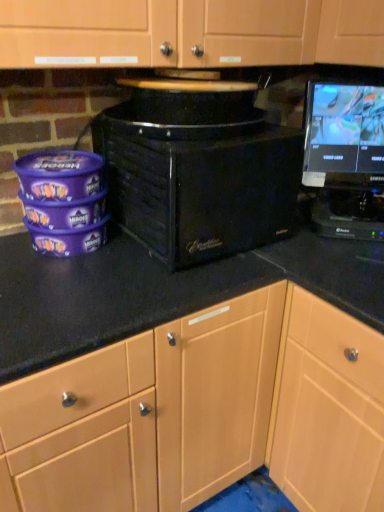
Question: Would you consider black matte microwave at center to be distant from light wood cabinet at lower right?

Choices:
 (A) no
 (B) yes

Answer: (A)

Question: From a real-world perspective, is black matte microwave at center beneath light wood cabinet at lower right?

Choices:
 (A) no
 (B) yes

Answer: (A)

Question: Is black matte microwave at center aimed at light wood cabinet at lower right?

Choices:
 (A) yes
 (B) no

Answer: (B)

Question: From the image's perspective, would you say black matte microwave at center is positioned over light wood cabinet at lower right?

Choices:
 (A) yes
 (B) no

Answer: (A)

Question: Does black matte microwave at center have a smaller size compared to light wood cabinet at lower right?

Choices:
 (A) no
 (B) yes

Answer: (B)

Question: Considering the relative positions of black glossy monitor at upper right and black matte microwave at center in the image provided, is black glossy monitor at upper right to the left or to the right of black matte microwave at center?

Choices:
 (A) left
 (B) right

Answer: (B)

Question: From a real-world perspective, relative to black matte microwave at center, is black glossy monitor at upper right vertically above or below?

Choices:
 (A) below
 (B) above

Answer: (B)

Question: Is black glossy monitor at upper right bigger or smaller than black matte microwave at center?

Choices:
 (A) big
 (B) small

Answer: (B)

Question: Is black glossy monitor at upper right inside or outside of black matte microwave at center?

Choices:
 (A) inside
 (B) outside

Answer: (B)

Question: In terms of size, does light wood cabinet at lower right appear bigger or smaller than black glossy monitor at upper right?

Choices:
 (A) big
 (B) small

Answer: (A)

Question: Considering the relative positions of light wood cabinet at lower right and black glossy monitor at upper right in the image provided, is light wood cabinet at lower right to the left or to the right of black glossy monitor at upper right?

Choices:
 (A) right
 (B) left

Answer: (A)

Question: From the image's perspective, is light wood cabinet at lower right positioned above or below black glossy monitor at upper right?

Choices:
 (A) below
 (B) above

Answer: (A)

Question: Relative to black glossy monitor at upper right, is light wood cabinet at lower right in front or behind?

Choices:
 (A) behind
 (B) front

Answer: (B)

Question: Considering the positions of black glossy monitor at upper right and light wood cabinet at lower right in the image, is black glossy monitor at upper right bigger or smaller than light wood cabinet at lower right?

Choices:
 (A) big
 (B) small

Answer: (B)

Question: From a real-world perspective, is black glossy monitor at upper right positioned above or below light wood cabinet at lower right?

Choices:
 (A) above
 (B) below

Answer: (A)